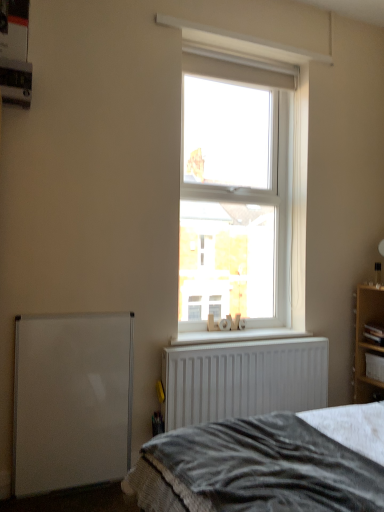
Question: Is wooden cabinet at right wider or thinner than wooden shelf at right?

Choices:
 (A) thin
 (B) wide

Answer: (A)

Question: Relative to wooden shelf at right, is wooden cabinet at right in front or behind?

Choices:
 (A) front
 (B) behind

Answer: (B)

Question: Based on their relative distances, which object is nearer to the textured gray blanket at lower center?

Choices:
 (A) wooden cabinet at right
 (B) clear glass window at center
 (C) white textured wood at center
 (D) white matte whiteboard at lower left
 (E) wooden shelf at right

Answer: (D)

Question: Which object is positioned farthest from the wooden shelf at right?

Choices:
 (A) clear glass window at center
 (B) white textured wood at center
 (C) textured gray blanket at lower center
 (D) white matte whiteboard at lower left
 (E) wooden cabinet at right

Answer: (D)